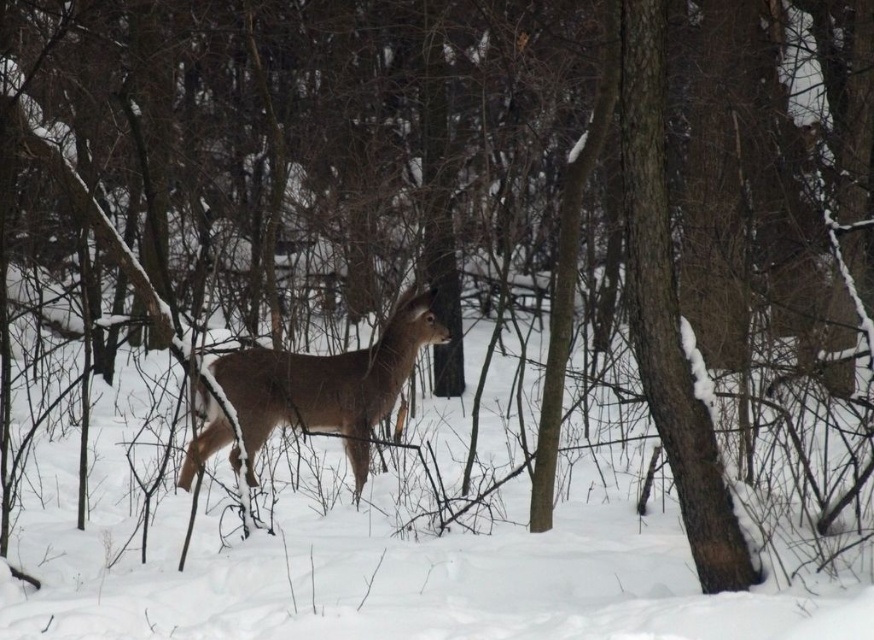
You are a photographer trying to capture the brown matte deer at center in the winter forest scene. You want to ensure that the white fluffy snow at center is visible in the background. Given that your camera has a depth of field that can focus clearly up to 6 feet, will the snow at center be in focus when the deer is the main subject?

The distance between the brown matte deer at center and the white fluffy snow at center is 5.58 feet, which is within the camera lens depth of field range of 6 feet. Therefore, the white fluffy snow at center will be in focus when the deer is the main subject.

You are an animal tracker observing the scene. You notice the white fluffy snow at center and the brown matte deer at center. Which object takes up more space in the image?

The brown matte deer at center takes up more space in the image because the white fluffy snow at center is smaller than it.